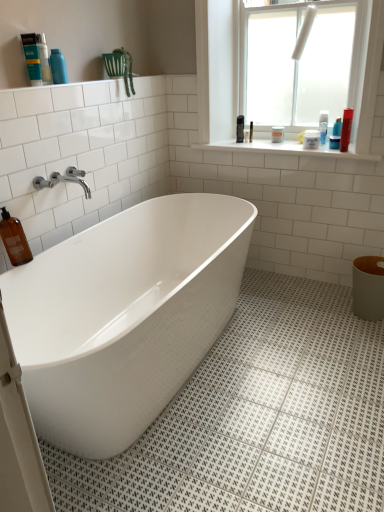
What do you see at coordinates (297, 65) in the screenshot? This screenshot has width=384, height=512. I see `white frosted glass at upper right` at bounding box center [297, 65].

What is the approximate width of blue glossy lotion at upper right, arranged as the 1th toiletry when viewed from the right?

2.44 inches.

At what (x,y) coordinates should I click in order to perform the action: click on white matte jar at upper right, which is the third toiletry from back to front. Please return your answer as a coordinate pair (x, y). The height and width of the screenshot is (512, 384). Looking at the image, I should click on (311, 139).

Where is `blue glossy lotion at upper right, the second toiletry positioned from the right`? This screenshot has width=384, height=512. blue glossy lotion at upper right, the second toiletry positioned from the right is located at coordinates [x=334, y=142].

Image resolution: width=384 pixels, height=512 pixels. Identify the location of white frosted glass window at upper right. (217, 68).

Is point (271, 105) behind point (318, 134)?

Yes, point (271, 105) is behind point (318, 134).

Is white matte jar at upper right, acting as the third toiletry starting from the right, completely or partially inside white frosted glass at upper right?

No, white matte jar at upper right, acting as the third toiletry starting from the right, is not inside white frosted glass at upper right.

Locate an element on the screen. window screen that is on the left side of white matte jar at upper right, placed as the third toiletry when sorted from left to right is located at coordinates tap(297, 65).

In terms of size, does white frosted glass at upper right appear bigger or smaller than white matte jar at upper right, placed as the third toiletry when sorted from left to right?

In the image, white frosted glass at upper right appears to be larger than white matte jar at upper right, placed as the third toiletry when sorted from left to right.

Which is less distant, [55,172] or [335,155]?

Positioned in front is point [55,172].

Is chrome metallic faucet at upper left looking in the opposite direction of white tile at upper center?

chrome metallic faucet at upper left is not turned away from white tile at upper center.

Is chrome metallic faucet at upper left behind white tile at upper center?

No.

How many degrees apart are the facing directions of chrome metallic faucet at upper left and white tile at upper center?

The angular difference between chrome metallic faucet at upper left and white tile at upper center is 88.9 degrees.

Is blue glossy bottle at upper left, which is counted as the 1th toiletry, starting from the front, shorter than white tile at upper center?

No, blue glossy bottle at upper left, which is counted as the 1th toiletry, starting from the front, is not shorter than white tile at upper center.

In the scene shown: Is there a large distance between blue glossy bottle at upper left, the fifth toiletry when ordered from right to left, and white tile at upper center?

Yes, blue glossy bottle at upper left, the fifth toiletry when ordered from right to left, and white tile at upper center are located far from each other.

Is point (64, 83) closer or farther from the camera than point (257, 149)?

Point (64, 83).

Is blue glossy bottle at upper left, the fifth toiletry when ordered from right to left, oriented away from white tile at upper center?

No, white tile at upper center is not at the back of blue glossy bottle at upper left, the fifth toiletry when ordered from right to left.

Is white matte jar at upper right, placed as the third toiletry when sorted from left to right, with matte blue bottle at upper left, which is counted as the 3th cleaning product, starting from the back?

No, white matte jar at upper right, placed as the third toiletry when sorted from left to right, is not making contact with matte blue bottle at upper left, which is counted as the 3th cleaning product, starting from the back.

Is matte blue bottle at upper left, the second cleaning product when ordered from top to bottom, completely or partially inside white matte jar at upper right, positioned as the third toiletry in front-to-back order?

No, matte blue bottle at upper left, the second cleaning product when ordered from top to bottom, is located outside of white matte jar at upper right, positioned as the third toiletry in front-to-back order.

Based on the photo, considering the relative positions of white matte jar at upper right, which is the third toiletry from back to front, and matte blue bottle at upper left, the second cleaning product when ordered from top to bottom, in the image provided, is white matte jar at upper right, which is the third toiletry from back to front, in front of matte blue bottle at upper left, the second cleaning product when ordered from top to bottom,?

No, it is not.

Is white matte jar at upper right, which is the third toiletry from back to front, thinner than matte blue bottle at upper left, which is counted as the 3th cleaning product, starting from the back?

Incorrect, the width of white matte jar at upper right, which is the third toiletry from back to front, is not less than that of matte blue bottle at upper left, which is counted as the 3th cleaning product, starting from the back.

From the image's perspective, is blue glossy bottle at upper left, arranged as the 1th toiletry when viewed from the left, above or below blue glossy lotion at upper right, placed as the fourth toiletry when sorted from back to front?

Based on their image positions, blue glossy bottle at upper left, arranged as the 1th toiletry when viewed from the left, is located above blue glossy lotion at upper right, placed as the fourth toiletry when sorted from back to front.

Is blue glossy bottle at upper left, which is counted as the 1th toiletry, starting from the front, not within blue glossy lotion at upper right, positioned as the second toiletry in front-to-back order?

Indeed, blue glossy bottle at upper left, which is counted as the 1th toiletry, starting from the front, is completely outside blue glossy lotion at upper right, positioned as the second toiletry in front-to-back order.

Considering the sizes of objects blue glossy bottle at upper left, the fifth toiletry when ordered from right to left, and blue glossy lotion at upper right, positioned as the second toiletry in front-to-back order, in the image provided, who is shorter, blue glossy bottle at upper left, the fifth toiletry when ordered from right to left, or blue glossy lotion at upper right, positioned as the second toiletry in front-to-back order,?

Standing shorter between the two is blue glossy lotion at upper right, positioned as the second toiletry in front-to-back order.

Is blue glossy bottle at upper left, which is counted as the 1th toiletry, starting from the front, not near blue glossy lotion at upper right, placed as the fourth toiletry when sorted from back to front?

Absolutely, blue glossy bottle at upper left, which is counted as the 1th toiletry, starting from the front, is distant from blue glossy lotion at upper right, placed as the fourth toiletry when sorted from back to front.

From the picture: Relative to white matte jar at upper right, acting as the third toiletry starting from the right, is blue glossy lotion at upper right, the second toiletry positioned from the right, in front or behind?

Visually, blue glossy lotion at upper right, the second toiletry positioned from the right, is located in front of white matte jar at upper right, acting as the third toiletry starting from the right.

Looking at this image, from a real-world perspective, relative to white matte jar at upper right, positioned as the third toiletry in front-to-back order, is blue glossy lotion at upper right, the second toiletry positioned from the right, vertically above or below?

Clearly, from a real-world perspective, blue glossy lotion at upper right, the second toiletry positioned from the right, is below white matte jar at upper right, positioned as the third toiletry in front-to-back order.

Is point (335, 141) closer or farther from the camera than point (305, 134)?

Point (335, 141) is positioned closer to the camera compared to point (305, 134).

Which of these two, white matte jar at upper right, positioned as the third toiletry in front-to-back order, or chrome metallic faucet at upper left, stands shorter?

Standing shorter between the two is white matte jar at upper right, positioned as the third toiletry in front-to-back order.

In terms of width, does white matte jar at upper right, which is the third toiletry from back to front, look wider or thinner when compared to chrome metallic faucet at upper left?

In the image, white matte jar at upper right, which is the third toiletry from back to front, appears to be more narrow than chrome metallic faucet at upper left.

Locate an element on the screen. The image size is (384, 512). tap below the white matte jar at upper right, positioned as the third toiletry in front-to-back order (from the image's perspective) is located at coordinates (x=63, y=180).

At what (x,y) coordinates should I click in order to perform the action: click on window screen on the left side of white matte jar at upper right, placed as the third toiletry when sorted from left to right. Please return your answer as a coordinate pair (x, y). The image size is (384, 512). Looking at the image, I should click on (297, 65).

The height and width of the screenshot is (512, 384). Identify the location of window sill behind the chrome metallic faucet at upper left. (284, 149).

When comparing their distances from matte blue bottle at upper left, the 3th cleaning product positioned from the front, does white matte jar at upper right, positioned as the third toiletry in front-to-back order, or shiny plastic bottle at upper right, positioned as the first cleaning product in back-to-front order, seem closer?

Among the two, white matte jar at upper right, positioned as the third toiletry in front-to-back order, is located nearer to matte blue bottle at upper left, the 3th cleaning product positioned from the front.

Estimate the real-world distances between objects in this image. Which object is closer to blue glossy lotion at upper right, the second toiletry positioned from the right, blue glossy lotion at upper right, acting as the second toiletry starting from the back, or white glossy bathtub at center?

Based on the image, blue glossy lotion at upper right, acting as the second toiletry starting from the back, appears to be nearer to blue glossy lotion at upper right, the second toiletry positioned from the right.

Looking at the image, which one is located closer to brown glass bottle at lower left, marked as the fourth cleaning product in a back-to-front arrangement, blue glossy lotion at upper right, the 5th toiletry when ordered from left to right, or blue glossy bottle at upper left, the fifth toiletry when ordered from right to left?

blue glossy bottle at upper left, the fifth toiletry when ordered from right to left, is positioned closer to the anchor brown glass bottle at lower left, marked as the fourth cleaning product in a back-to-front arrangement.

From the image, which object appears to be nearer to chrome metallic faucet at upper left, blue glossy lotion at upper right, acting as the second toiletry starting from the back, or white matte jar at upper right, which is the third toiletry from back to front?

white matte jar at upper right, which is the third toiletry from back to front, is closer to chrome metallic faucet at upper left.

Considering their positions, is blue glossy lotion at upper right, acting as the 4th toiletry starting from the left, positioned closer to white frosted glass window at upper right than white matte jar at upper right, the 1th toiletry when ordered from back to front?

white matte jar at upper right, the 1th toiletry when ordered from back to front, is positioned closer to the anchor white frosted glass window at upper right.

Looking at the image, which one is located closer to brown glass bottle at lower left, acting as the first cleaning product starting from the left, blue glossy lotion at upper right, placed as the fourth toiletry when sorted from back to front, or white frosted glass window at upper right?

white frosted glass window at upper right is closer to brown glass bottle at lower left, acting as the first cleaning product starting from the left.

From the image, which object appears to be nearer to white frosted glass window at upper right, white matte jar at upper right, which appears as the 5th toiletry when viewed from the front, or brown glass bottle at lower left, the first cleaning product viewed from the front?

white matte jar at upper right, which appears as the 5th toiletry when viewed from the front, lies closer to white frosted glass window at upper right than the other object.

Estimate the real-world distances between objects in this image. Which object is closer to white frosted glass window at upper right, white matte jar at upper right, which is counted as the fourth toiletry, starting from the right, or white frosted glass at upper right?

white frosted glass at upper right is positioned closer to the anchor white frosted glass window at upper right.

Locate an element on the screen. The width and height of the screenshot is (384, 512). cleaning product between matte blue bottle at upper left, which appears as the third cleaning product when ordered from the bottom, and blue glossy bottle at upper left, marked as the 5th toiletry in a back-to-front arrangement, in the front-back direction is located at coordinates (44, 59).

You are a GUI agent. You are given a task and a screenshot of the screen. Output one action in this format:
    pyautogui.click(x=<x>, y=<y>)
    Task: Click on the cleaning product between matte blue bottle at upper left, which ranks as the second cleaning product in front-to-back order, and white matte jar at upper right, which is the third toiletry from back to front, from left to right
    
    Given the screenshot: What is the action you would take?
    pyautogui.click(x=44, y=59)

The height and width of the screenshot is (512, 384). I want to click on tap situated between matte blue bottle at upper left, the second cleaning product when ordered from top to bottom, and white frosted glass at upper right from left to right, so click(63, 180).

In order to click on bathtub located between matte blue bottle at upper left, marked as the third cleaning product in a left-to-right arrangement, and blue glossy lotion at upper right, acting as the second toiletry starting from the back, in the left-right direction in this screenshot , I will do `click(124, 316)`.